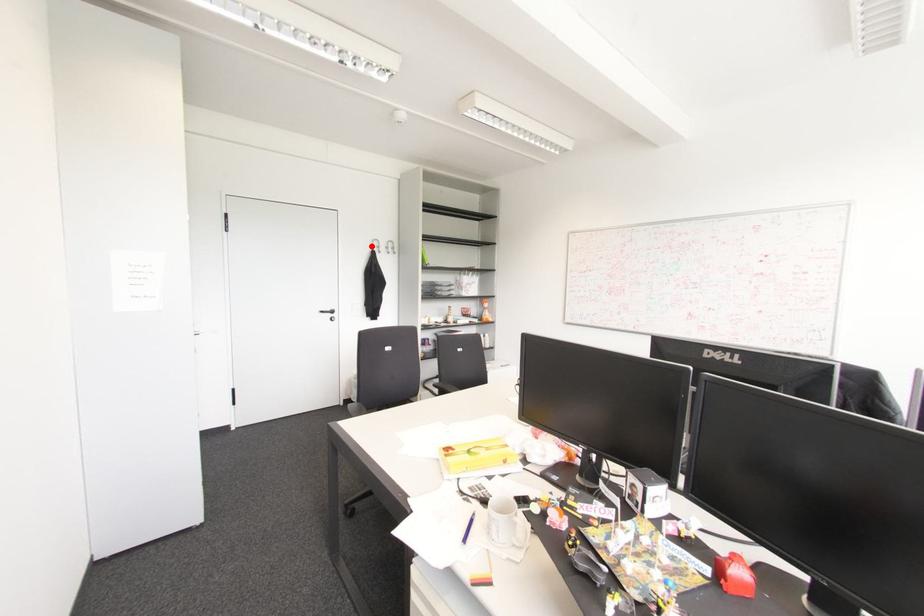
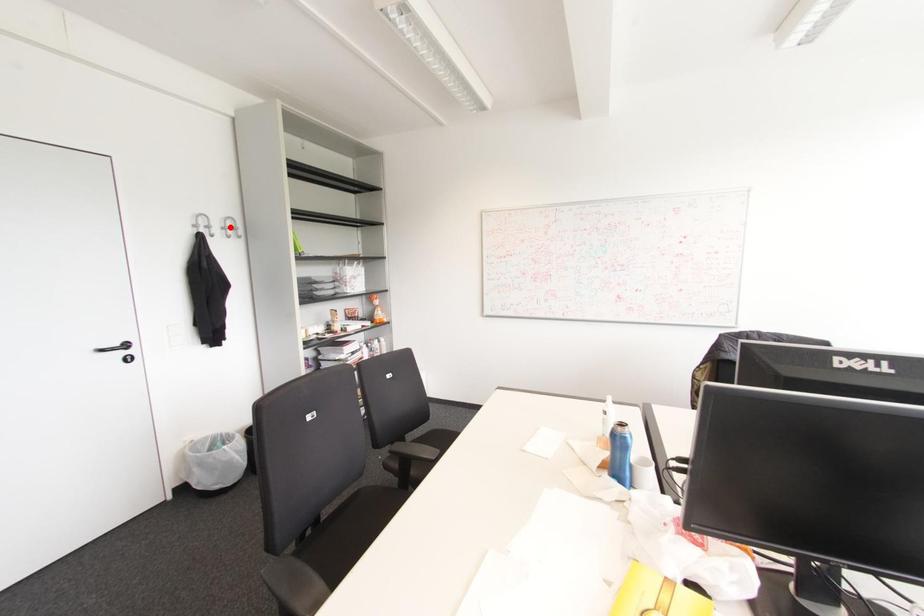
I am providing you with two images of the same scene from different viewpoints. A red point is marked on the first image and another point is marked on the second image. Does the point marked in image1 correspond to the same location as the one in image2?

No